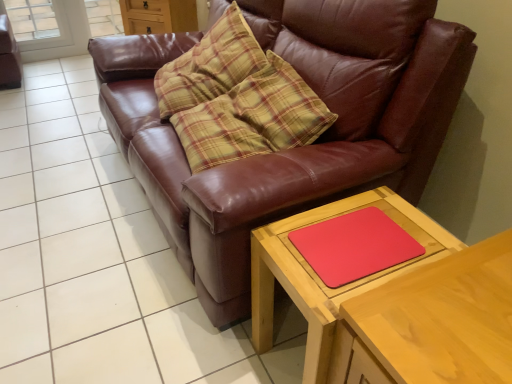
This screenshot has width=512, height=384. Find the location of `free space above wooden table at lower right, the first table positioned from the left (from a real-world perspective)`. free space above wooden table at lower right, the first table positioned from the left (from a real-world perspective) is located at coordinates (362, 238).